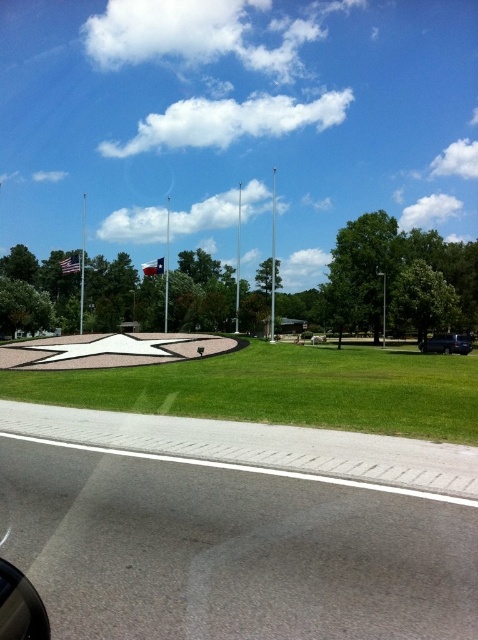
Question: Is green grass at center further to the viewer compared to transparent glass car window at lower left?

Choices:
 (A) no
 (B) yes

Answer: (B)

Question: Can you confirm if transparent glass car window at lower left is thinner than black matte car at lower right?

Choices:
 (A) no
 (B) yes

Answer: (A)

Question: Which point appears farthest from the camera in this image?

Choices:
 (A) (24, 634)
 (B) (394, 356)
 (C) (428, 349)

Answer: (C)

Question: Is transparent glass car window at lower left to the left of black matte car at lower right from the viewer's perspective?

Choices:
 (A) no
 (B) yes

Answer: (B)

Question: Which point is farther to the camera?

Choices:
 (A) (434, 412)
 (B) (12, 566)

Answer: (A)

Question: Which point is closer to the camera?

Choices:
 (A) (435, 349)
 (B) (6, 608)
 (C) (444, 392)

Answer: (B)